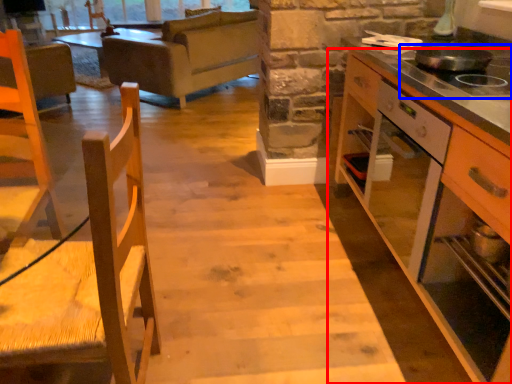
Question: Which of the following is the closest to the observer, cabinetry (highlighted by a red box) or gas stove (highlighted by a blue box)?

Choices:
 (A) cabinetry
 (B) gas stove

Answer: (A)